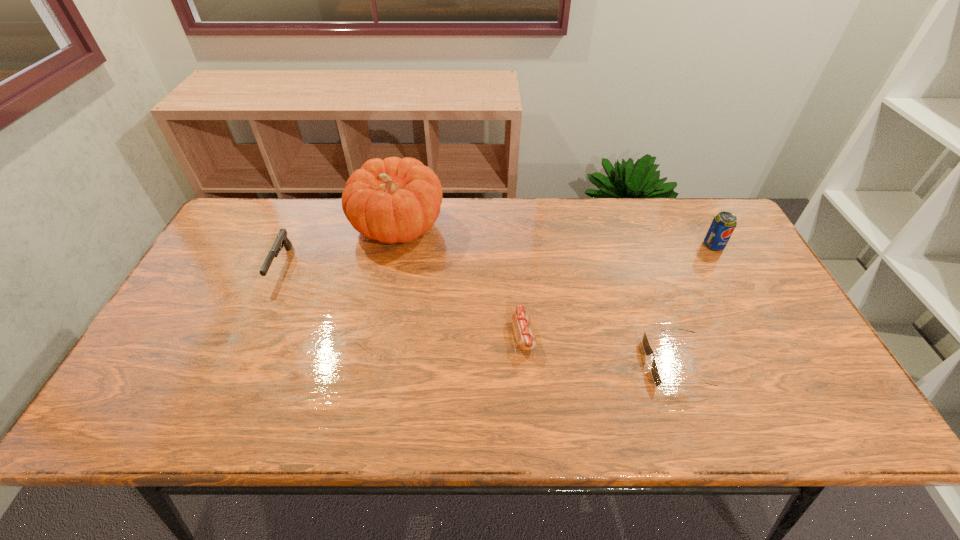
Locate an element on the screen. free space between the leftmost object and the sausage is located at coordinates (x=402, y=300).

Locate an element on the screen. vacant space that's between the rightmost object and the sunglasses is located at coordinates (694, 305).

You are a GUI agent. You are given a task and a screenshot of the screen. Output one action in this format:
    pyautogui.click(x=<x>, y=<y>)
    Task: Click on the vacant space that is in between the third object from right to left and the sunglasses
    This screenshot has height=540, width=960.
    Given the screenshot: What is the action you would take?
    pyautogui.click(x=599, y=349)

The height and width of the screenshot is (540, 960). Identify the location of free space between the pumpkin and the shortest object. (537, 295).

Locate an element on the screen. This screenshot has height=540, width=960. vacant area between the tallest object and the gun is located at coordinates (340, 246).

Find the location of a particular element. Image resolution: width=960 pixels, height=540 pixels. free point between the third shortest object and the soda is located at coordinates (497, 255).

Find the location of a particular element. object that is the closest to the leftmost object is located at coordinates (393, 200).

Where is `object that stands as the second closest to the fourth object from right to left`? Image resolution: width=960 pixels, height=540 pixels. object that stands as the second closest to the fourth object from right to left is located at coordinates (526, 339).

In order to click on free point that satisfies the following two spatial constraints: 1. on the front side of the fourth shortest object; 2. on the right side of the tallest object in this screenshot , I will do `click(394, 245)`.

Where is `vacant position in the image that satisfies the following two spatial constraints: 1. at the muzzle end of the leftmost object; 2. on the left side of the sausage`? The width and height of the screenshot is (960, 540). vacant position in the image that satisfies the following two spatial constraints: 1. at the muzzle end of the leftmost object; 2. on the left side of the sausage is located at coordinates (250, 335).